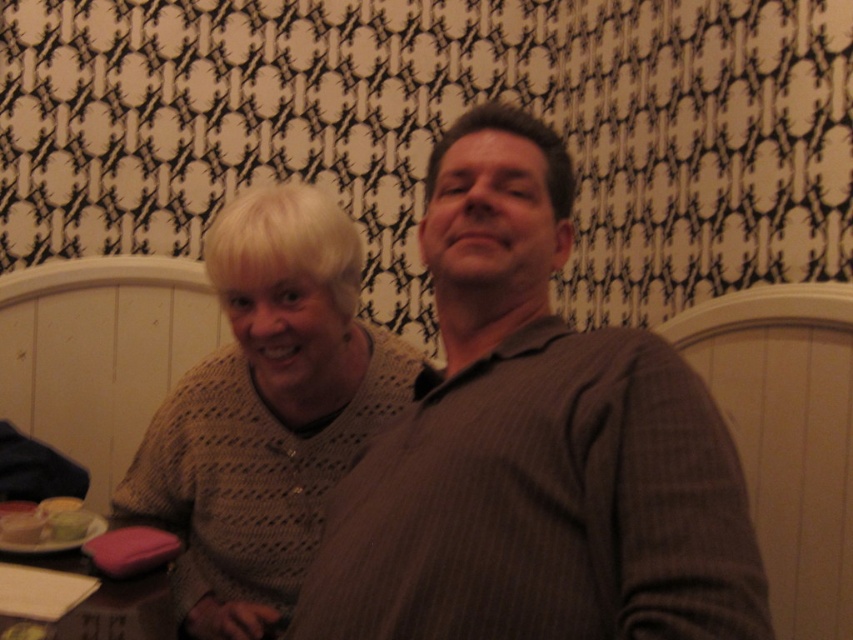
Question: Which of the following is the closest to the observer?

Choices:
 (A) (166, 573)
 (B) (566, 160)
 (C) (32, 541)
 (D) (262, 212)

Answer: (B)

Question: Among these points, which one is farthest from the camera?

Choices:
 (A) (271, 365)
 (B) (585, 436)
 (C) (15, 547)
 (D) (33, 556)

Answer: (D)

Question: Is pink fabric at lower left positioned in front of matte plastic container at lower left?

Choices:
 (A) yes
 (B) no

Answer: (A)

Question: Can you confirm if knitted beige sweater at center is wider than pink fabric at lower left?

Choices:
 (A) no
 (B) yes

Answer: (B)

Question: Is gray striped shirt at center bigger than pink fabric at lower left?

Choices:
 (A) no
 (B) yes

Answer: (B)

Question: Which of the following is the closest to the observer?

Choices:
 (A) (61, 497)
 (B) (315, 326)

Answer: (B)